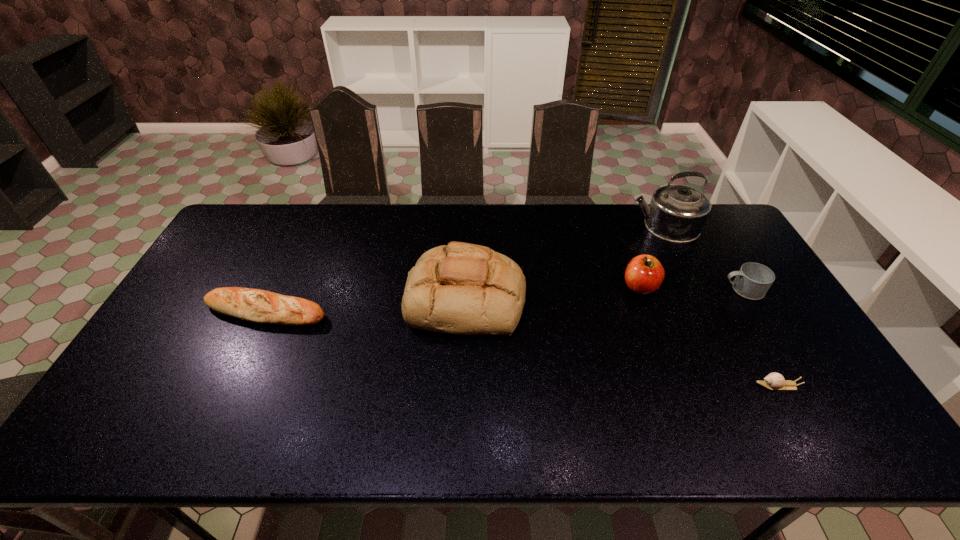
You are a GUI agent. You are given a task and a screenshot of the screen. Output one action in this format:
    pyautogui.click(x=<x>, y=<y>)
    Task: Click on the free space located 0.180m on the shell of the escargot
    
    Given the screenshot: What is the action you would take?
    pyautogui.click(x=685, y=386)

Locate an element on the screen. The image size is (960, 540). object present at the far edge is located at coordinates (677, 213).

Image resolution: width=960 pixels, height=540 pixels. In order to click on object that is at the left edge in this screenshot , I will do `click(254, 305)`.

Identify the location of kettle present at the right edge. This screenshot has width=960, height=540. (677, 213).

You are a GUI agent. You are given a task and a screenshot of the screen. Output one action in this format:
    pyautogui.click(x=<x>, y=<y>)
    Task: Click on the mug present at the right edge
    
    Given the screenshot: What is the action you would take?
    pyautogui.click(x=753, y=280)

The width and height of the screenshot is (960, 540). I want to click on escargot positioned at the right edge, so click(x=774, y=381).

Where is `object that is at the far right corner`? This screenshot has width=960, height=540. object that is at the far right corner is located at coordinates (677, 213).

Where is `vacant area at the far edge of the desktop`? The height and width of the screenshot is (540, 960). vacant area at the far edge of the desktop is located at coordinates (283, 224).

Where is `vacant region at the near edge of the desktop`? This screenshot has width=960, height=540. vacant region at the near edge of the desktop is located at coordinates (660, 421).

At what (x,y) coordinates should I click in order to perform the action: click on vacant space at the left edge of the desktop. Please return your answer as a coordinate pair (x, y). The width and height of the screenshot is (960, 540). Looking at the image, I should click on (231, 268).